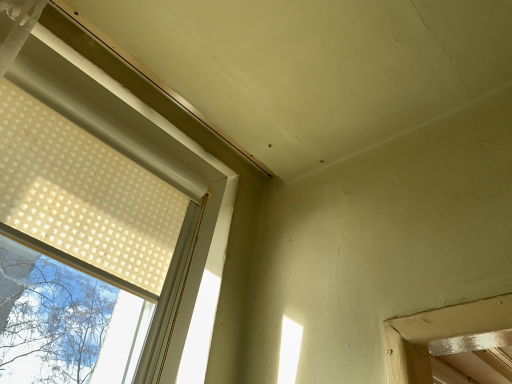
What are the coordinates of `white textured roller blind at upper left` in the screenshot? It's located at (84, 194).

Describe the element at coordinates (84, 194) in the screenshot. I see `white textured roller blind at upper left` at that location.

Where is `white textured roller blind at upper left`? This screenshot has width=512, height=384. white textured roller blind at upper left is located at coordinates (84, 194).